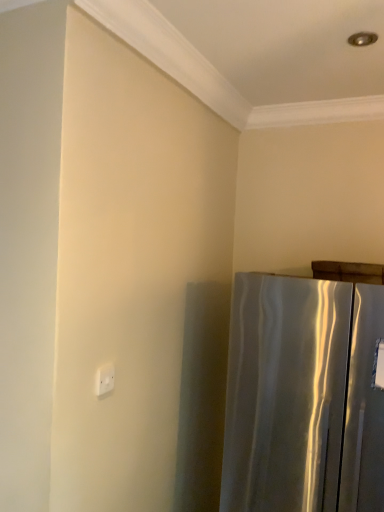
Question: Looking at their shapes, would you say white plastic electric outlet at upper left is wider or thinner than satin silver refrigerator at right?

Choices:
 (A) wide
 (B) thin

Answer: (B)

Question: Relative to satin silver refrigerator at right, is white plastic electric outlet at upper left in front or behind?

Choices:
 (A) front
 (B) behind

Answer: (B)

Question: From a real-world perspective, relative to satin silver refrigerator at right, is white plastic electric outlet at upper left vertically above or below?

Choices:
 (A) below
 (B) above

Answer: (B)

Question: Is satin silver refrigerator at right wider or thinner than white plastic electric outlet at upper left?

Choices:
 (A) wide
 (B) thin

Answer: (A)

Question: Choose the correct answer: Is satin silver refrigerator at right inside white plastic electric outlet at upper left or outside it?

Choices:
 (A) inside
 (B) outside

Answer: (B)

Question: In the image, is satin silver refrigerator at right positioned in front of or behind white plastic electric outlet at upper left?

Choices:
 (A) behind
 (B) front

Answer: (B)

Question: From the image's perspective, is satin silver refrigerator at right above or below white plastic electric outlet at upper left?

Choices:
 (A) above
 (B) below

Answer: (B)